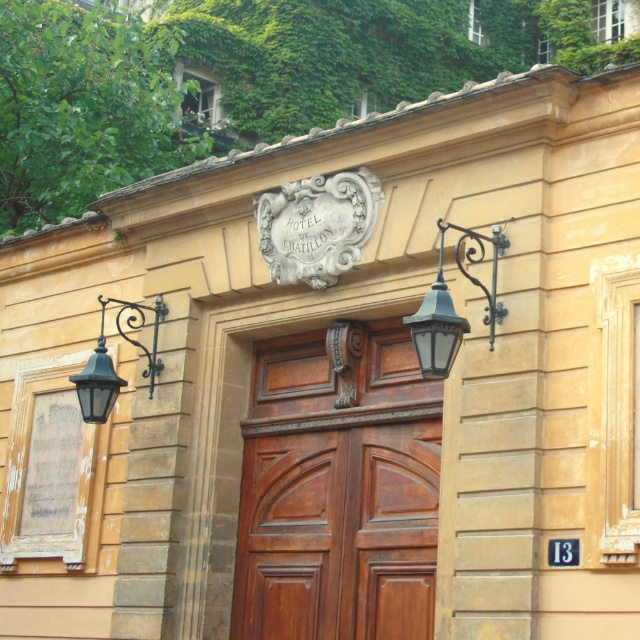
You are standing in front of the Hotel de Chatillon and want to enter through the entrance. There is a polished wood door at center and a matte black lantern at center right. Which object is located above the other?

The matte black lantern at center right is located above the polished wood door at center because the door is positioned under the lantern.